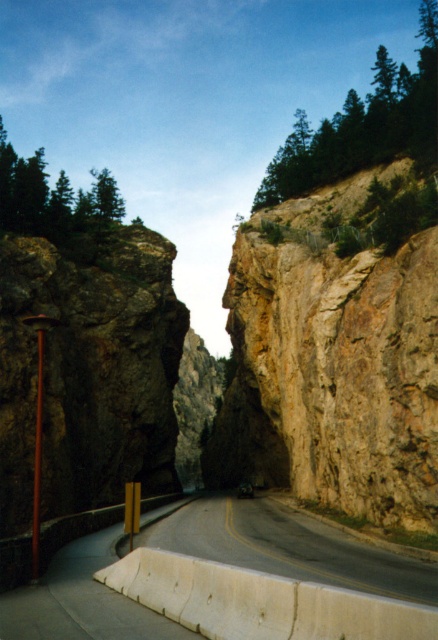
Question: Can you confirm if white concrete barrier at lower center is thinner than green leafy tree at upper left?

Choices:
 (A) no
 (B) yes

Answer: (B)

Question: Is brown rough rock face at right thinner than white concrete barrier at lower center?

Choices:
 (A) no
 (B) yes

Answer: (A)

Question: Based on their relative distances, which object is farther from the green leafy tree at upper left?

Choices:
 (A) green textured trees at upper right
 (B) brown rough rock face at right

Answer: (A)

Question: Which of the following is the farthest from the observer?

Choices:
 (A) green textured trees at upper right
 (B) white concrete barrier at lower center

Answer: (A)

Question: Which point is closer to the camera?

Choices:
 (A) white concrete barrier at lower center
 (B) green textured trees at upper right
 (C) brown rough rock face at right
 (D) green leafy tree at upper left

Answer: (A)

Question: Is brown rough rock face at right further to camera compared to white concrete barrier at lower center?

Choices:
 (A) no
 (B) yes

Answer: (B)